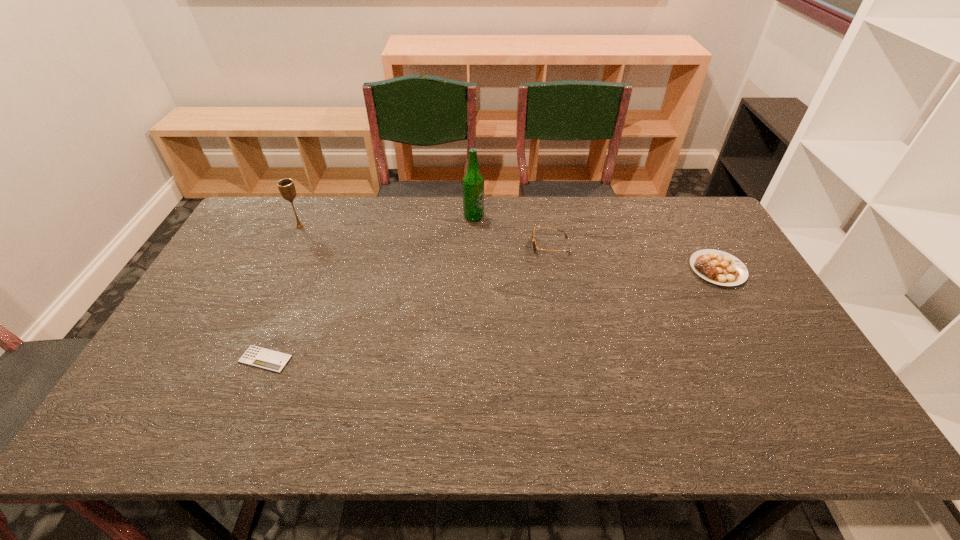
This screenshot has width=960, height=540. What are the coordinates of `beer bottle` in the screenshot? It's located at (473, 182).

Where is `the tallest object`? The height and width of the screenshot is (540, 960). the tallest object is located at coordinates (473, 182).

Identify the location of the fourth shortest object. (286, 186).

Identify the location of the third shortest object. (533, 239).

Find the location of a particular element. sunglasses is located at coordinates (533, 239).

The image size is (960, 540). Identify the location of the second shortest object. (718, 267).

Locate an element on the screen. The image size is (960, 540). steak is located at coordinates (718, 267).

The height and width of the screenshot is (540, 960). I want to click on the shortest object, so click(263, 358).

At what (x,y) coordinates should I click in order to perform the action: click on the nearest object. Please return your answer as a coordinate pair (x, y). Looking at the image, I should click on (263, 358).

This screenshot has height=540, width=960. Identify the location of free location located 0.230m on the label of the beer bottle. (550, 217).